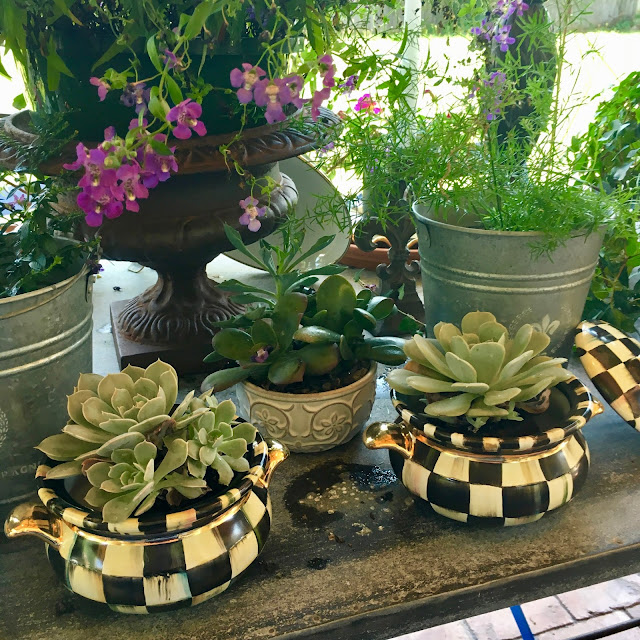
Identify the location of floor. This screenshot has height=640, width=640. (544, 618).